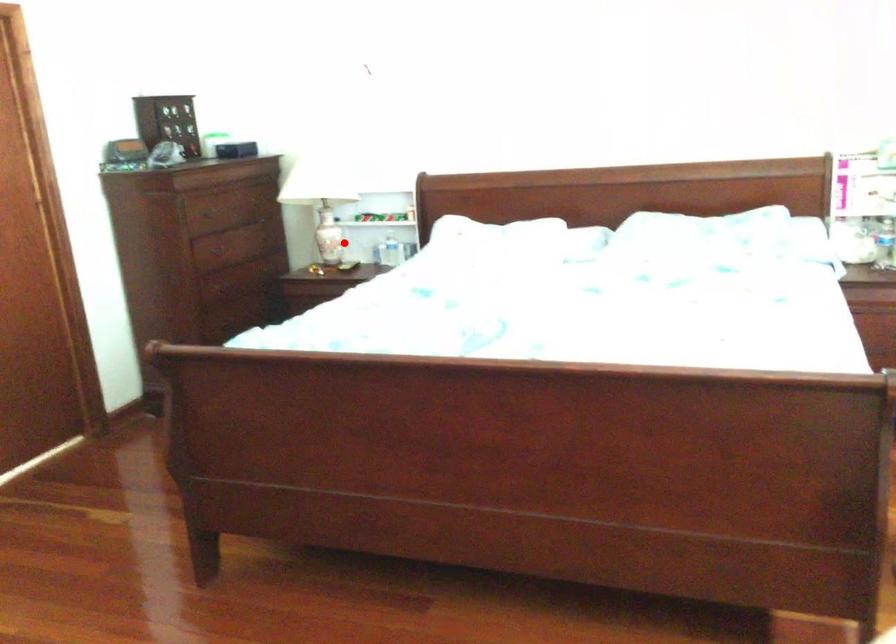
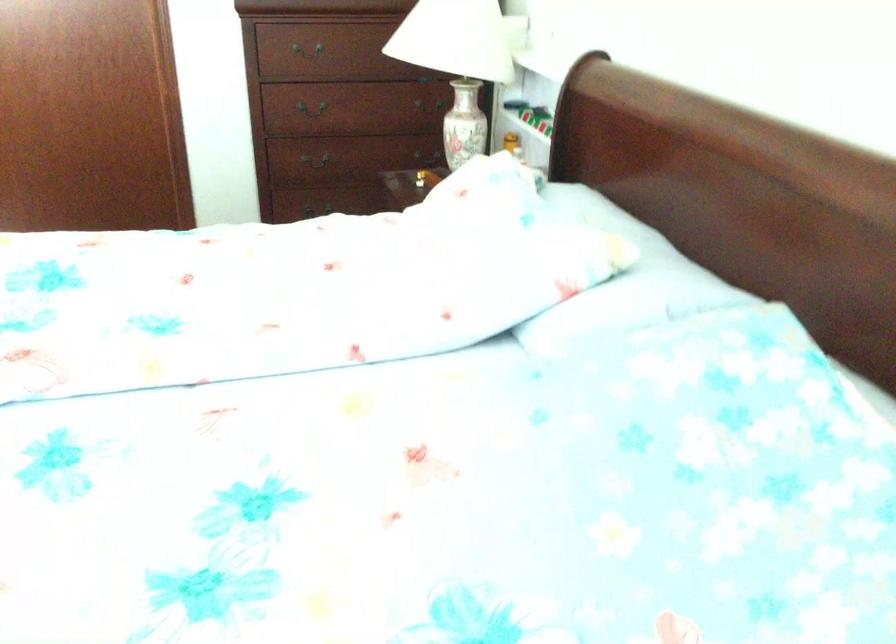
Find the pixel in the second image that matches the highlighted location in the first image.

(463, 124)